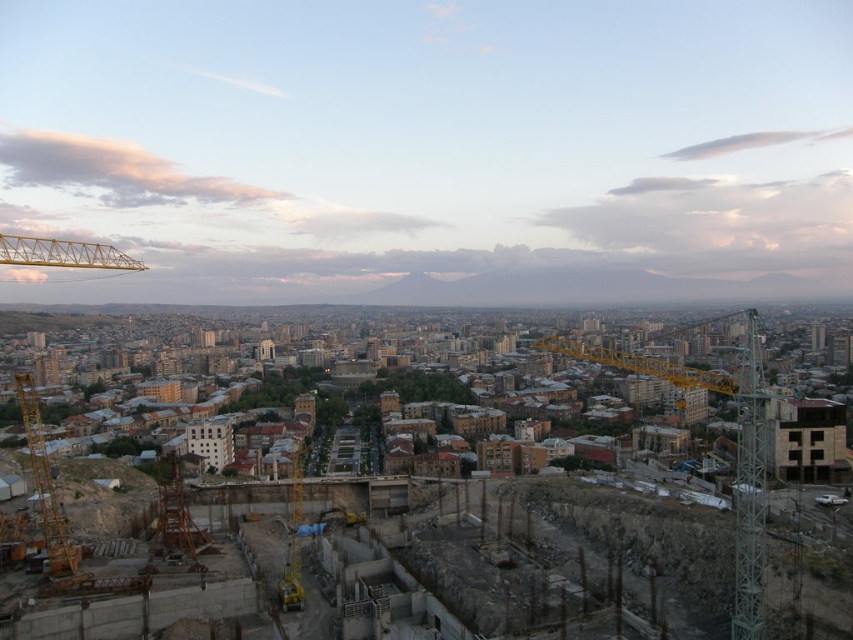
Question: Which object is farther from the camera taking this photo?

Choices:
 (A) concrete construction site at center
 (B) yellow metallic crane at left
 (C) yellow metallic crane at right

Answer: (B)

Question: Which object is closer to the camera taking this photo?

Choices:
 (A) concrete construction site at center
 (B) yellow metallic crane at lower left

Answer: (A)

Question: Is yellow metallic crane at lower left thinner than yellow metallic crane at left?

Choices:
 (A) no
 (B) yes

Answer: (A)

Question: Is yellow metallic crane at right to the right of yellow metallic crane at lower left from the viewer's perspective?

Choices:
 (A) no
 (B) yes

Answer: (B)

Question: Can you confirm if concrete construction site at center is wider than yellow metallic crane at right?

Choices:
 (A) yes
 (B) no

Answer: (B)

Question: Which object is farther from the camera taking this photo?

Choices:
 (A) yellow metallic crane at left
 (B) yellow metallic crane at lower left

Answer: (A)